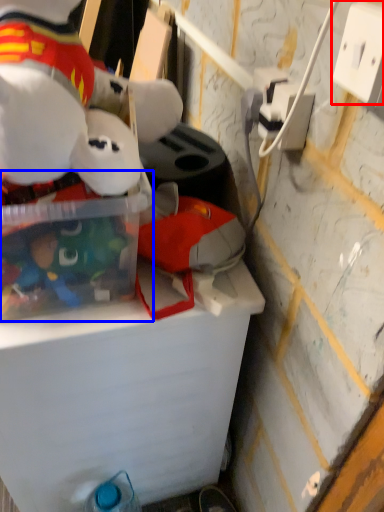
Question: Which object is closer to the camera taking this photo, power outlet (highlighted by a red box) or storage box (highlighted by a blue box)?

Choices:
 (A) power outlet
 (B) storage box

Answer: (A)